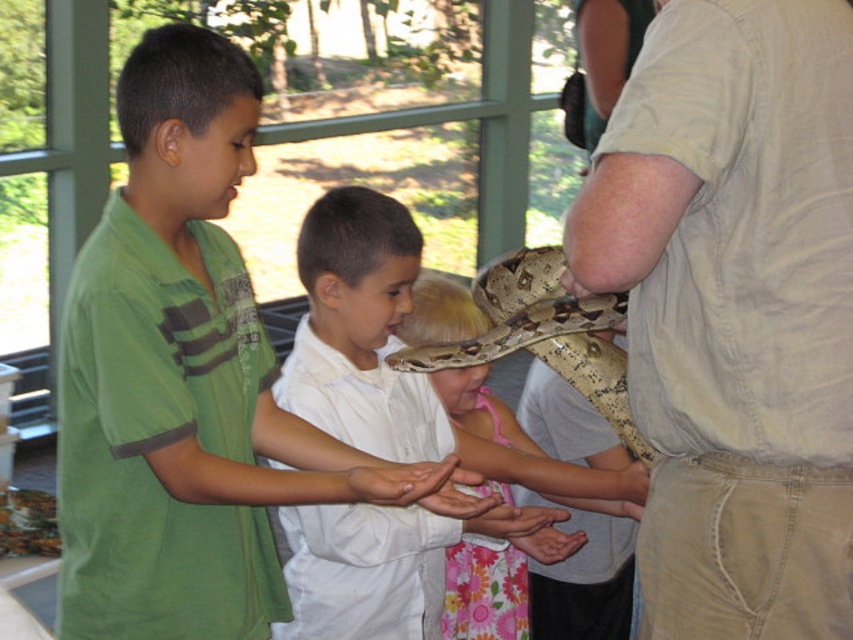
What is the color of the object located at point coordinates (160, 211)?

The object at point coordinates (160, 211) is green.

You are a photographer standing in front of the glass enclosure where the children are interacting with the snake. You want to take a clear photo of the brown scaly snake at center without any obstruction. Will the matte white shirt at center block your view of the snake?

The brown scaly snake at center is closer to the viewer than the matte white shirt at center, so the snake will not be blocked by the shirt in your photo.

You are a photographer trying to capture a clear photo of the brown scaly snake at center and the matte white shirt at center. Since the snake is moving, you need to focus on the larger object first. Which object should you focus on first?

The brown scaly snake at center is larger in size than the matte white shirt at center, so you should focus on the brown scaly snake at center first.